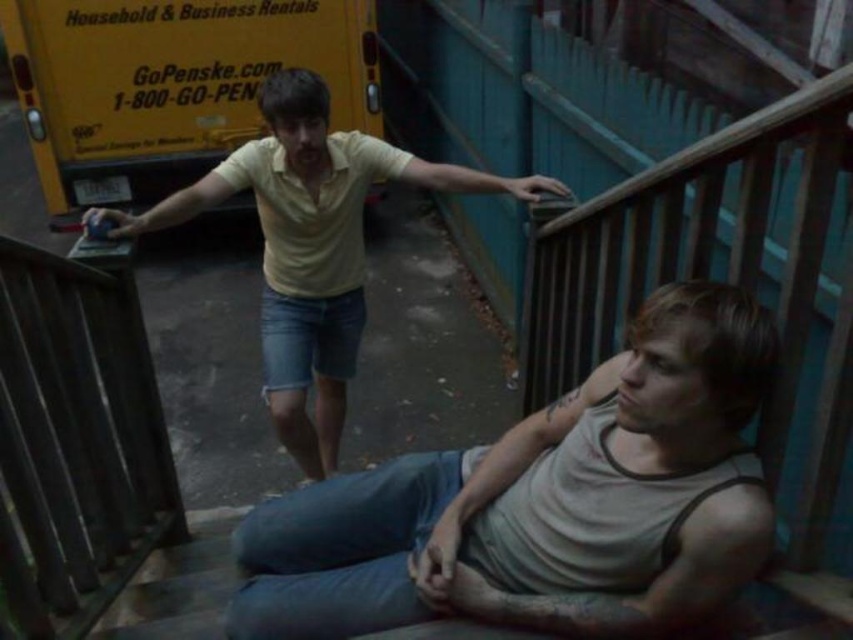
Between yellow matte truck at upper left and yellow cotton shirt at upper center, which one has more height?

Standing taller between the two is yellow cotton shirt at upper center.

Who is lower down, yellow matte truck at upper left or yellow cotton shirt at upper center?

yellow cotton shirt at upper center is below.

Describe the element at coordinates (170, 83) in the screenshot. I see `yellow matte truck at upper left` at that location.

Locate an element on the screen. The width and height of the screenshot is (853, 640). yellow matte truck at upper left is located at coordinates (170, 83).

Which is above, wooden balustrade at lower left or yellow matte truck at upper left?

yellow matte truck at upper left is above.

Is wooden balustrade at lower left wider than yellow matte truck at upper left?

In fact, wooden balustrade at lower left might be narrower than yellow matte truck at upper left.

Image resolution: width=853 pixels, height=640 pixels. What are the coordinates of `wooden balustrade at lower left` in the screenshot? It's located at (76, 438).

In order to click on wooden balustrade at lower left in this screenshot , I will do `click(76, 438)`.

Describe the element at coordinates (76, 438) in the screenshot. The height and width of the screenshot is (640, 853). I see `wooden balustrade at lower left` at that location.

Does wooden balustrade at lower left appear under yellow cotton shirt at upper center?

Correct, wooden balustrade at lower left is located below yellow cotton shirt at upper center.

Where is `wooden balustrade at lower left`? wooden balustrade at lower left is located at coordinates (76, 438).

What are the coordinates of `wooden balustrade at lower left` in the screenshot? It's located at (76, 438).